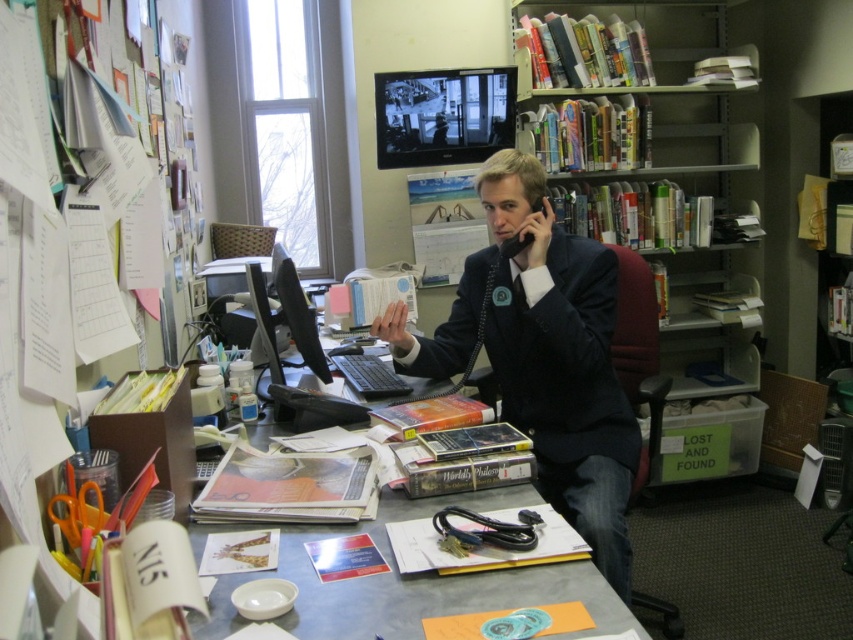
Question: Can you confirm if hardcover books at upper right is wider than metallic gray desk at center?

Choices:
 (A) yes
 (B) no

Answer: (A)

Question: Estimate the real-world distances between objects in this image. Which object is farther from the black suit at center?

Choices:
 (A) metallic gray desk at center
 (B) hardcover books at upper right

Answer: (B)

Question: Is hardcover books at upper right in front of black suit at center?

Choices:
 (A) yes
 (B) no

Answer: (B)

Question: From the image, what is the correct spatial relationship of black suit at center in relation to metallic gray desk at center?

Choices:
 (A) below
 (B) above

Answer: (B)

Question: Which object is farther from the camera taking this photo?

Choices:
 (A) hardcover books at upper right
 (B) black suit at center

Answer: (A)

Question: Estimate the real-world distances between objects in this image. Which object is closer to the hardcover books at upper right?

Choices:
 (A) black suit at center
 (B) metallic gray desk at center

Answer: (A)